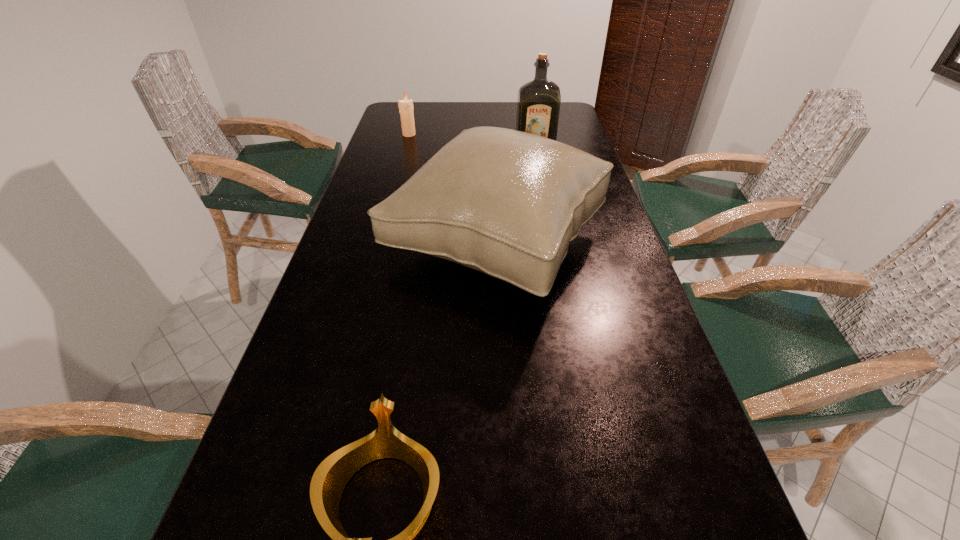
The image size is (960, 540). I want to click on liquor, so click(x=538, y=106).

Where is `the third farthest object`? Image resolution: width=960 pixels, height=540 pixels. the third farthest object is located at coordinates (507, 203).

Where is `cushion`? Image resolution: width=960 pixels, height=540 pixels. cushion is located at coordinates (507, 203).

This screenshot has width=960, height=540. Identify the location of candle. (406, 108).

Locate an element on the screen. the farthest object is located at coordinates (406, 108).

Find the location of a particular element. The image size is (960, 540). free space located on the label of the second farthest object is located at coordinates (549, 229).

Find the location of `free space located 0.150m on the front of the second nearest object`. free space located 0.150m on the front of the second nearest object is located at coordinates (500, 387).

The image size is (960, 540). Find the location of `vacant space located on the back of the second shortest object`. vacant space located on the back of the second shortest object is located at coordinates (412, 124).

Locate an element on the screen. The height and width of the screenshot is (540, 960). cushion located in the left edge section of the desktop is located at coordinates (507, 203).

Identify the location of candle located in the left edge section of the desktop. (406, 108).